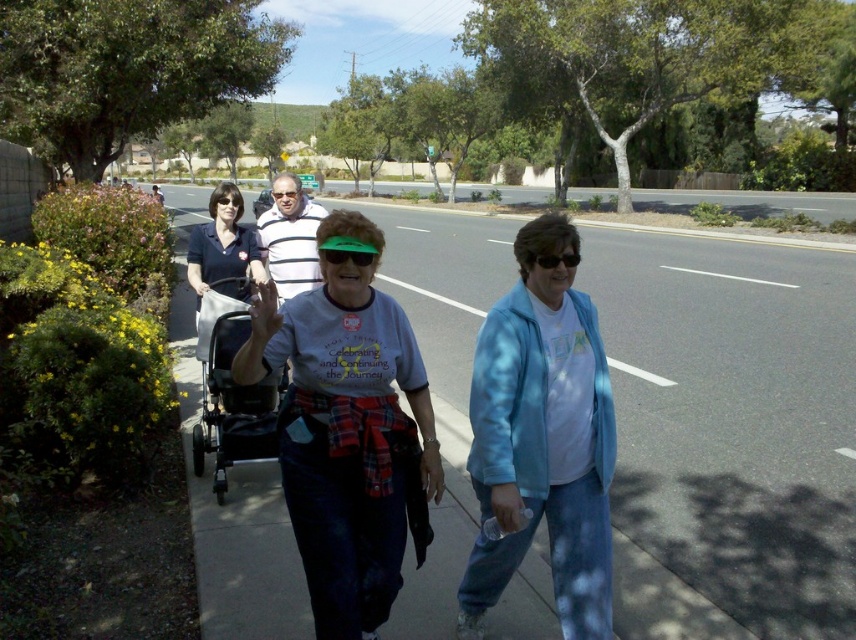
Looking at this image, you are a pedestrian trying to cross the road. You see asphalt at center and green matte sunglasses at center. Which object is bigger and can help you determine where the road is?

The asphalt at center is larger in size than the green matte sunglasses at center, so the asphalt at center is bigger and indicates the road area.